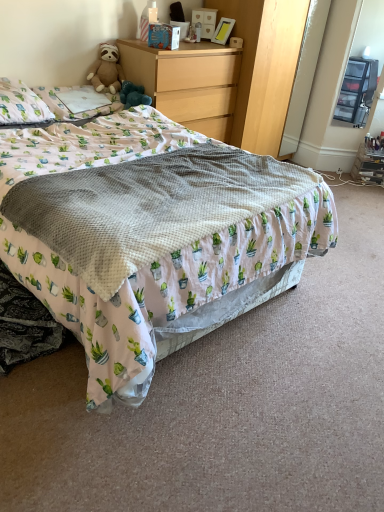
Question: Can you confirm if white fabric pillow at upper left, the 2th pillow when ordered from right to left, is thinner than wooden dresser at upper center?

Choices:
 (A) yes
 (B) no

Answer: (A)

Question: Is wooden dresser at upper center surrounded by white fabric pillow at upper left, which is counted as the 1th pillow, starting from the left?

Choices:
 (A) yes
 (B) no

Answer: (B)

Question: Considering the relative positions of white fabric pillow at upper left, which is counted as the 1th pillow, starting from the left, and wooden dresser at upper center in the image provided, is white fabric pillow at upper left, which is counted as the 1th pillow, starting from the left, to the left of wooden dresser at upper center from the viewer's perspective?

Choices:
 (A) yes
 (B) no

Answer: (A)

Question: Is white fabric pillow at upper left, the 2th pillow when ordered from right to left, oriented away from wooden dresser at upper center?

Choices:
 (A) no
 (B) yes

Answer: (A)

Question: Are white fabric pillow at upper left, which is counted as the 1th pillow, starting from the left, and wooden dresser at upper center beside each other?

Choices:
 (A) yes
 (B) no

Answer: (B)

Question: Is white fabric pillow at upper left, which is counted as the 1th pillow, starting from the left, behind wooden dresser at upper center?

Choices:
 (A) yes
 (B) no

Answer: (B)

Question: From a real-world perspective, is white printed blanket at center on white cotton pillow at upper left, the 1th pillow positioned from the right?

Choices:
 (A) no
 (B) yes

Answer: (A)

Question: From a real-world perspective, is white printed blanket at center located beneath white cotton pillow at upper left, the 2th pillow when ordered from left to right?

Choices:
 (A) yes
 (B) no

Answer: (A)

Question: Could you tell me if white printed blanket at center is facing white cotton pillow at upper left, the 1th pillow positioned from the right?

Choices:
 (A) yes
 (B) no

Answer: (B)

Question: Considering the relative positions of white printed blanket at center and white cotton pillow at upper left, the 1th pillow positioned from the right, in the image provided, is white printed blanket at center behind white cotton pillow at upper left, the 1th pillow positioned from the right,?

Choices:
 (A) yes
 (B) no

Answer: (B)

Question: From the image's perspective, is white printed blanket at center above white cotton pillow at upper left, the 1th pillow positioned from the right?

Choices:
 (A) yes
 (B) no

Answer: (B)

Question: Is white printed blanket at center not close to white cotton pillow at upper left, the 2th pillow when ordered from left to right?

Choices:
 (A) no
 (B) yes

Answer: (A)

Question: From a real-world perspective, is white cotton pillow at upper left, the 2th pillow when ordered from left to right, below wooden dresser at upper center?

Choices:
 (A) no
 (B) yes

Answer: (B)